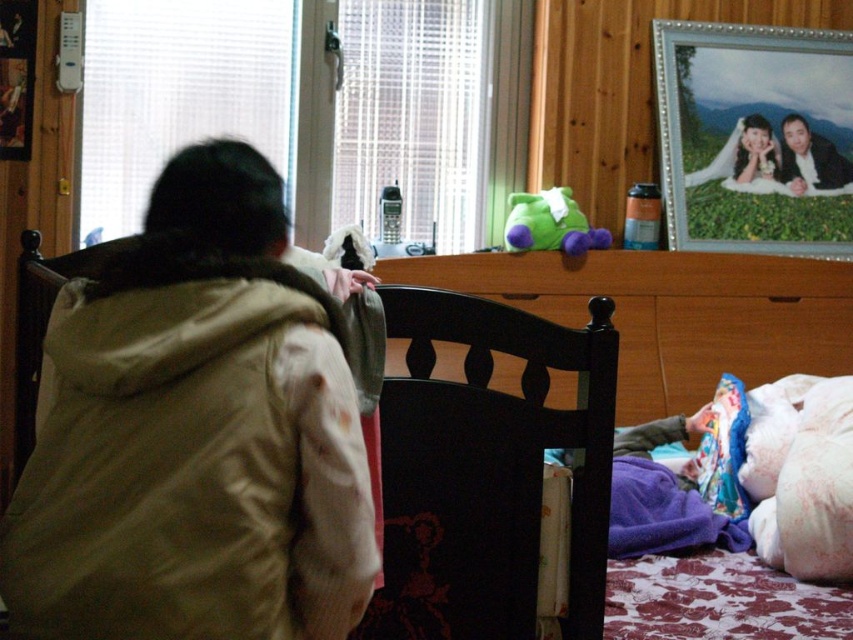
You are standing at the camera position in the bedroom scene. There is a green plush toy at upper center that you want to reach. Can you grab it without moving from your current position?

The green plush toy at upper center is 3.08 meters away from the camera position. Since the average arm length is about 0.7 meters, you cannot reach it without moving.